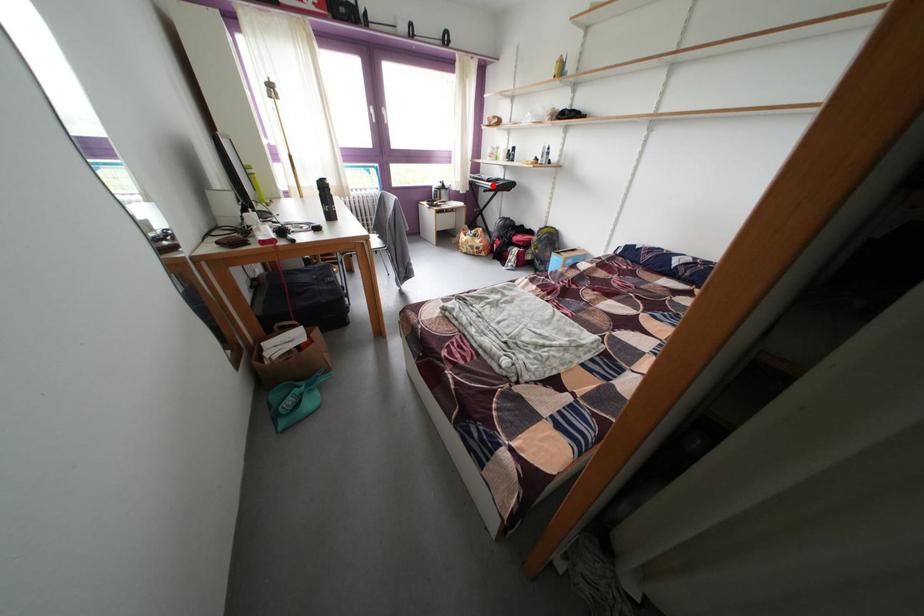
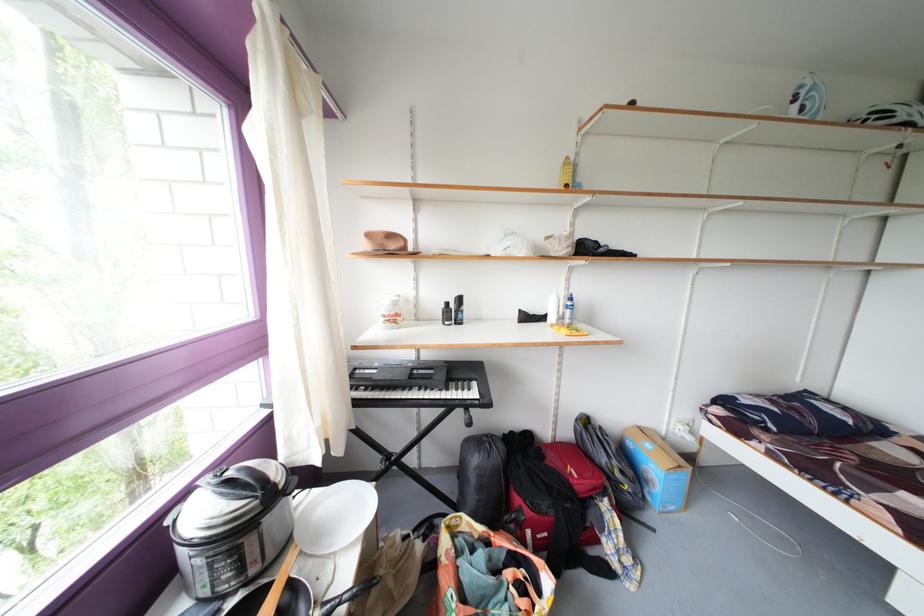
In the second image, find the point that corresponds to the highlighted location in the first image.

(427, 394)